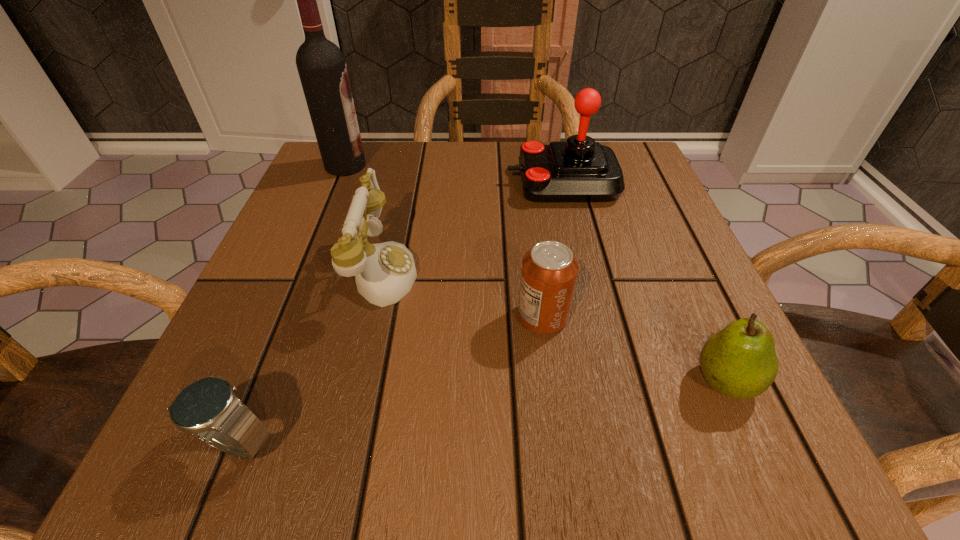
At what (x,y) coordinates should I click in order to perform the action: click on telephone positioned at the left edge. Please return your answer as a coordinate pair (x, y). This screenshot has width=960, height=540. Looking at the image, I should click on (385, 272).

Locate an element on the screen. The width and height of the screenshot is (960, 540). watch that is at the left edge is located at coordinates (208, 408).

I want to click on joystick at the right edge, so click(x=579, y=169).

Find the location of a particular element. Image resolution: width=960 pixels, height=540 pixels. pear that is positioned at the right edge is located at coordinates (739, 361).

You are a GUI agent. You are given a task and a screenshot of the screen. Output one action in this format:
    pyautogui.click(x=<x>, y=<y>)
    Task: Click on the object that is at the far left corner
    The height and width of the screenshot is (540, 960).
    Given the screenshot: What is the action you would take?
    pyautogui.click(x=321, y=65)

I want to click on object that is at the near left corner, so click(208, 408).

Identify the location of object located at the far right corner. The image size is (960, 540). (579, 169).

Where is `object that is at the near right corner`? Image resolution: width=960 pixels, height=540 pixels. object that is at the near right corner is located at coordinates (739, 361).

This screenshot has height=540, width=960. In the image, there is a desktop. Find the location of `vacant space at the far edge`. vacant space at the far edge is located at coordinates (480, 151).

Locate an element on the screen. The height and width of the screenshot is (540, 960). vacant space at the near edge of the desktop is located at coordinates (408, 449).